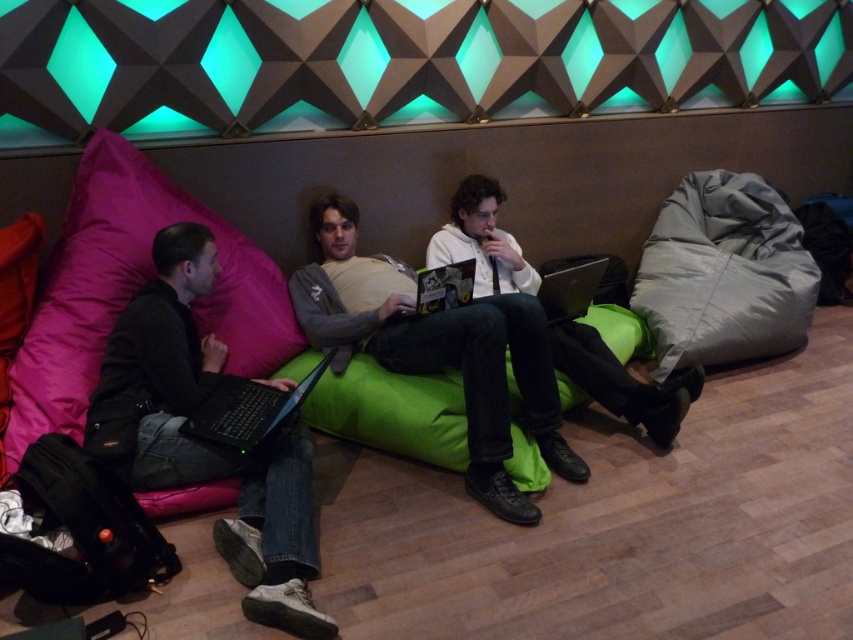
Question: Which point is closer to the camera?

Choices:
 (A) black matte laptop at left
 (B) pink fabric pillow at left
 (C) matte black laptop at center
 (D) matte white shirt at center

Answer: (B)

Question: Which object appears farthest from the camera in this image?

Choices:
 (A) black glossy laptop at center
 (B) gray matte bean bag chair at right
 (C) pink fabric pillow at left

Answer: (B)

Question: Observing the image, what is the correct spatial positioning of light brown leather jacket at center in reference to gray matte bean bag chair at right?

Choices:
 (A) above
 (B) below

Answer: (B)

Question: Is pink fabric pillow at left above gray matte bean bag chair at right?

Choices:
 (A) yes
 (B) no

Answer: (B)

Question: Based on their relative distances, which object is nearer to the pink fabric pillow at left?

Choices:
 (A) gray matte bean bag chair at right
 (B) matte white shirt at center
 (C) matte black laptop at left
 (D) black glossy laptop at center

Answer: (C)

Question: Is pink fabric pillow at left closer to the viewer compared to black glossy laptop at center?

Choices:
 (A) no
 (B) yes

Answer: (B)